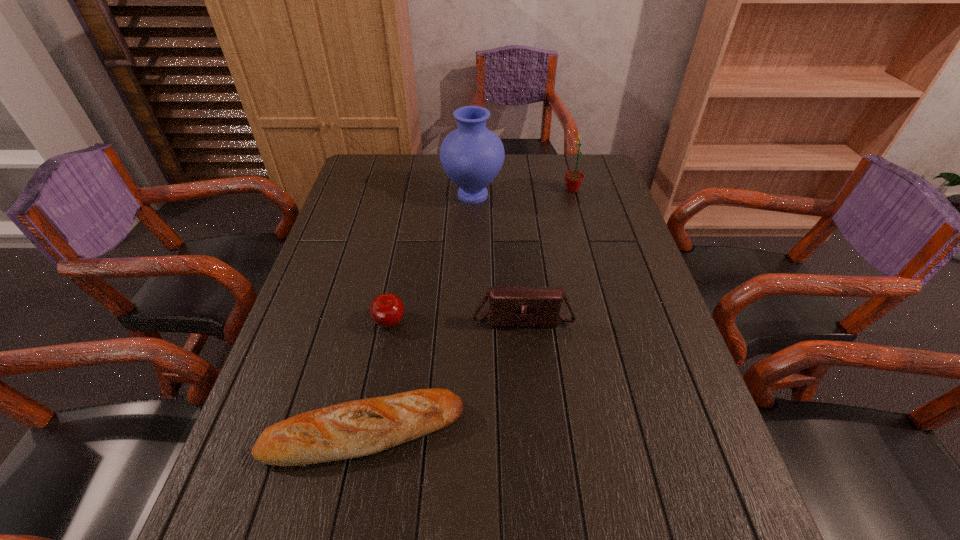
Identify the location of the tallest object. (472, 156).

The height and width of the screenshot is (540, 960). I want to click on the rightmost object, so click(573, 179).

Find the location of a particular element. This screenshot has width=960, height=540. sunflower is located at coordinates (573, 179).

The width and height of the screenshot is (960, 540). I want to click on shoulder bag, so click(x=536, y=307).

You are a GUI agent. You are given a task and a screenshot of the screen. Output one action in this format:
    pyautogui.click(x=<x>, y=<y>)
    Task: Click on the cherry
    
    Given the screenshot: What is the action you would take?
    pyautogui.click(x=386, y=310)

The width and height of the screenshot is (960, 540). I want to click on baguet, so click(x=352, y=429).

Find the location of a particular element. The height and width of the screenshot is (540, 960). the shortest object is located at coordinates (352, 429).

The image size is (960, 540). In order to click on vacant position located 0.120m on the front of the vase in this screenshot , I will do `click(472, 237)`.

In order to click on vacant space located on the face of the sunflower in this screenshot , I will do `click(534, 190)`.

Where is `free spot located on the face of the sunflower`? This screenshot has height=540, width=960. free spot located on the face of the sunflower is located at coordinates (510, 190).